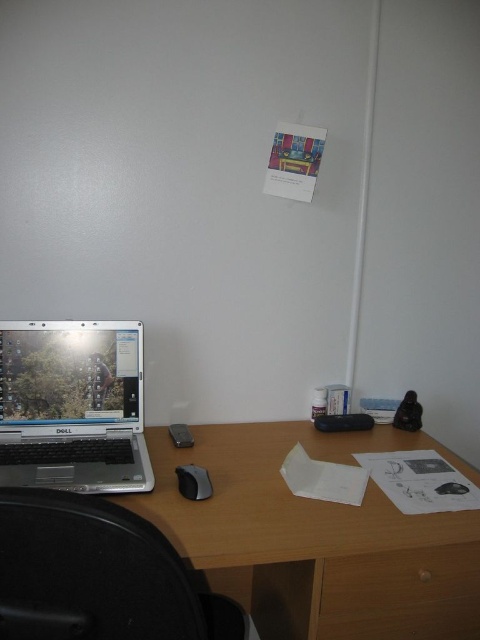
Question: Which object is farther from the camera taking this photo?

Choices:
 (A) black matte mouse at lower center
 (B) silver metallic laptop at lower left

Answer: (A)

Question: Is silver metallic laptop at lower left positioned before black matte mouse at lower center?

Choices:
 (A) yes
 (B) no

Answer: (A)

Question: Among these objects, which one is nearest to the camera?

Choices:
 (A) silver metallic laptop at lower left
 (B) black matte mouse at lower center

Answer: (A)

Question: Is black plastic swivel chair at lower left positioned at the back of wooden drawer at lower right?

Choices:
 (A) no
 (B) yes

Answer: (A)

Question: Is wooden at center positioned before wooden drawer at lower right?

Choices:
 (A) yes
 (B) no

Answer: (A)

Question: Which point appears closest to the camera in this image?

Choices:
 (A) (343, 616)
 (B) (477, 528)

Answer: (B)